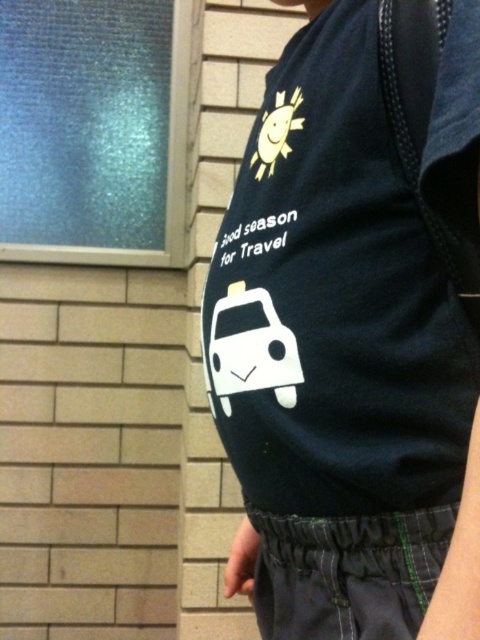
Question: Which point is farther to the camera?

Choices:
 (A) (337, 520)
 (B) (432, 90)

Answer: (A)

Question: Can you confirm if navy blue cotton t-shirt at center is wider than dark blue fabric pocket at lower center?

Choices:
 (A) yes
 (B) no

Answer: (A)

Question: Among these objects, which one is nearest to the camera?

Choices:
 (A) navy blue cotton t-shirt at center
 (B) dark blue fabric pocket at lower center

Answer: (A)

Question: Observing the image, what is the correct spatial positioning of navy blue cotton t-shirt at center in reference to dark blue fabric pocket at lower center?

Choices:
 (A) above
 (B) below

Answer: (A)

Question: Does navy blue cotton t-shirt at center have a greater width compared to dark blue fabric pocket at lower center?

Choices:
 (A) yes
 (B) no

Answer: (A)